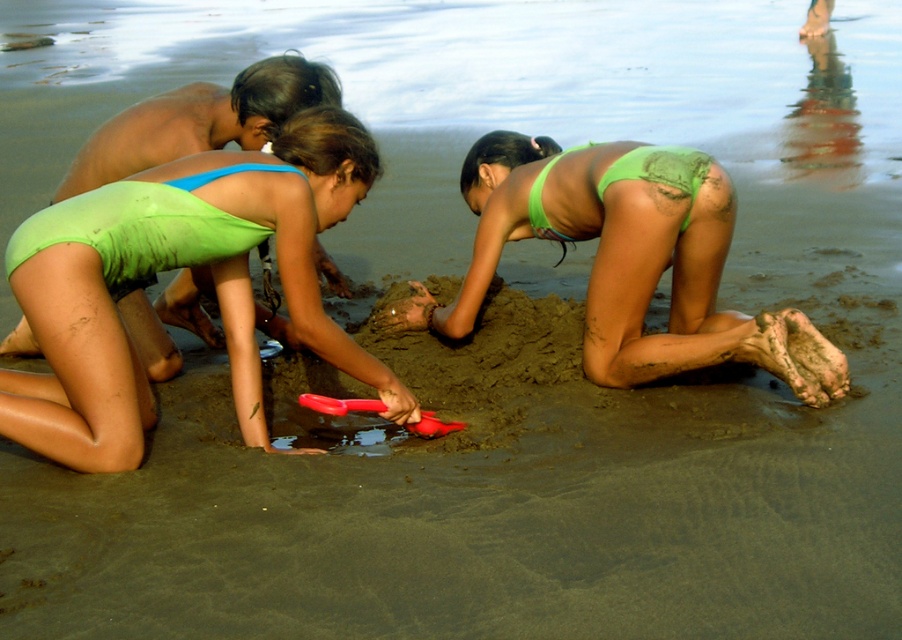
You are a photographer positioned at the edge of the beach scene. You want to capture a photo that includes both the green matte swimsuit at center and the green matte bikini bottom at center. Which object will appear larger in the photo?

The green matte swimsuit at center will appear larger in the photo because it is closer to the viewer than the green matte bikini bottom at center.